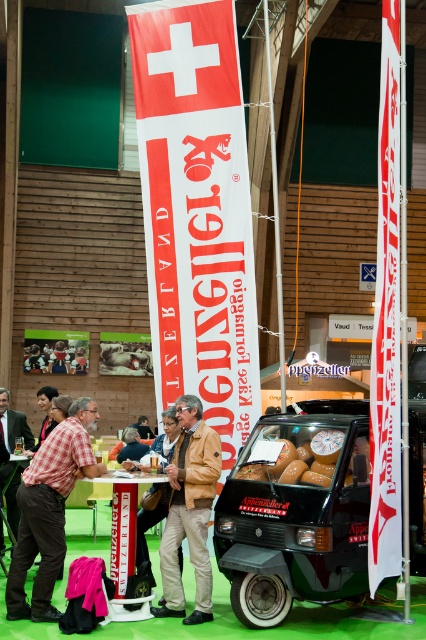
Between brown leather jacket at center and checkered fabric shirt at center, which one has less height?

checkered fabric shirt at center

Who is more distant from viewer, (195, 422) or (23, 432)?

The point (23, 432) is behind.

You are a GUI agent. You are given a task and a screenshot of the screen. Output one action in this format:
    pyautogui.click(x=<x>, y=<y>)
    Task: Click on the brown leather jacket at center
    This screenshot has height=640, width=426.
    Given the screenshot: What is the action you would take?
    [x=189, y=512]

Does point (416, 435) come closer to viewer compared to point (176, 586)?

No.

Which is more to the left, green matte car at center or brown leather jacket at center?

From the viewer's perspective, brown leather jacket at center appears more on the left side.

Who is more distant from viewer, (267, 472) or (175, 598)?

Point (267, 472)

You are a GUI agent. You are given a task and a screenshot of the screen. Output one action in this format:
    pyautogui.click(x=<x>, y=<y>)
    Task: Click on the green matte car at center
    
    Given the screenshot: What is the action you would take?
    pyautogui.click(x=298, y=513)

Can you confirm if green matte car at center is bigger than plaid shirt at center?

Result: Indeed, green matte car at center has a larger size compared to plaid shirt at center.

Can you confirm if green matte car at center is positioned to the right of plaid shirt at center?

Correct, you'll find green matte car at center to the right of plaid shirt at center.

Between point (342, 452) and point (48, 451), which one is positioned behind?

The point (342, 452) is behind.

I want to click on green matte car at center, so click(298, 513).